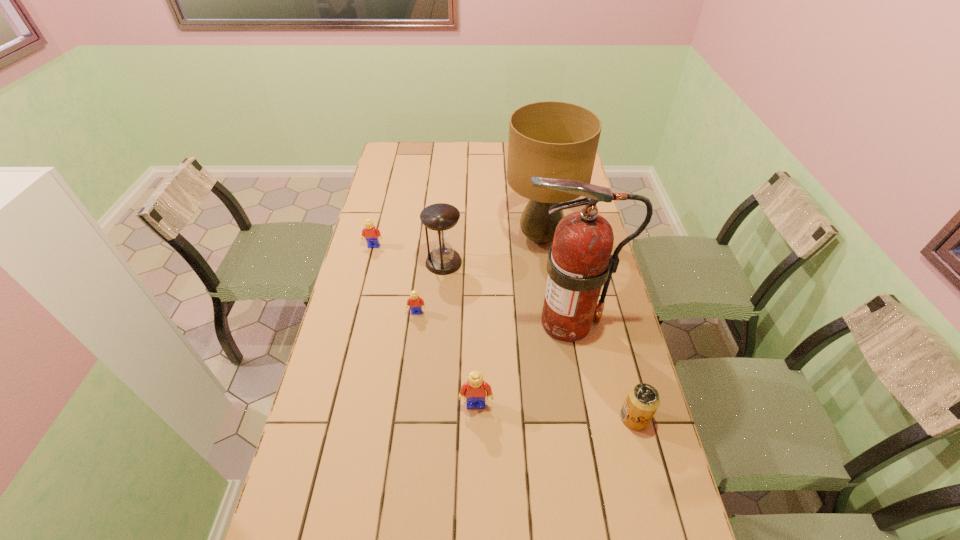
This screenshot has height=540, width=960. Identify the location of fire extinguisher that is at the right edge. tap(579, 263).

The width and height of the screenshot is (960, 540). I want to click on lampshade that is at the right edge, so click(550, 139).

Image resolution: width=960 pixels, height=540 pixels. I want to click on beer can situated at the right edge, so click(642, 401).

This screenshot has width=960, height=540. In the image, there is a desktop. What are the coordinates of `vacant space at the far edge` in the screenshot? It's located at (433, 155).

In the image, there is a desktop. Where is `vacant region at the left edge`? vacant region at the left edge is located at coordinates (312, 423).

The width and height of the screenshot is (960, 540). I want to click on vacant region at the right edge of the desktop, so click(612, 488).

In the image, there is a desktop. What are the coordinates of `vacant space at the far left corner` in the screenshot? It's located at (405, 166).

Identify the location of free point between the second Lego from left to right and the beer can. (526, 365).

At what (x,y) coordinates should I click in order to perform the action: click on vacant space that's between the fire extinguisher and the beer can. Please return your answer as a coordinate pair (x, y). Looking at the image, I should click on (601, 370).

Identify the location of vacant point located between the second Lego from right to left and the beer can. The image size is (960, 540). (526, 365).